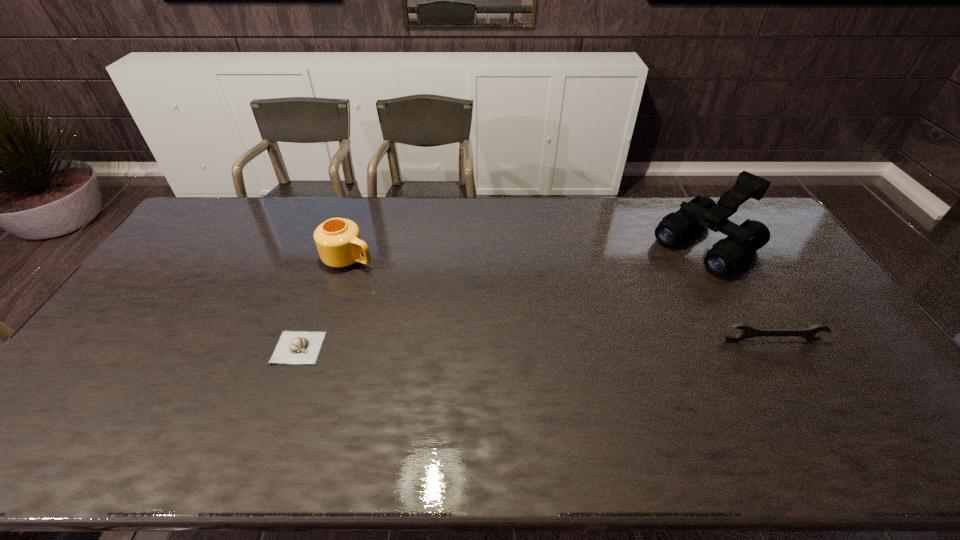
Find the location of a particular element. The image size is (960, 540). vacant area situated 0.170m on the handle side of the mug is located at coordinates tap(413, 283).

You are a GUI agent. You are given a task and a screenshot of the screen. Output one action in this format:
    pyautogui.click(x=<x>, y=<y>)
    Task: Click on the free location located on the handle side of the mug
    The image size is (960, 540).
    Given the screenshot: What is the action you would take?
    pyautogui.click(x=477, y=310)

The height and width of the screenshot is (540, 960). I want to click on object that is positioned at the far edge, so click(x=743, y=240).

Image resolution: width=960 pixels, height=540 pixels. Find the location of `wrench present at the right edge`. wrench present at the right edge is located at coordinates (747, 332).

The width and height of the screenshot is (960, 540). I want to click on binoculars at the right edge, so click(x=743, y=240).

Where is `object that is positioned at the far right corner`? object that is positioned at the far right corner is located at coordinates (743, 240).

This screenshot has width=960, height=540. In the image, there is a desktop. In order to click on vacant space at the far edge in this screenshot , I will do `click(449, 212)`.

Identify the location of vacant space at the near edge of the desktop. This screenshot has width=960, height=540. (663, 399).

Find the location of a particular element. The height and width of the screenshot is (540, 960). free space at the left edge of the desktop is located at coordinates pyautogui.click(x=124, y=320).

Identify the location of free region at the far right corner of the desktop. This screenshot has height=540, width=960. (742, 207).